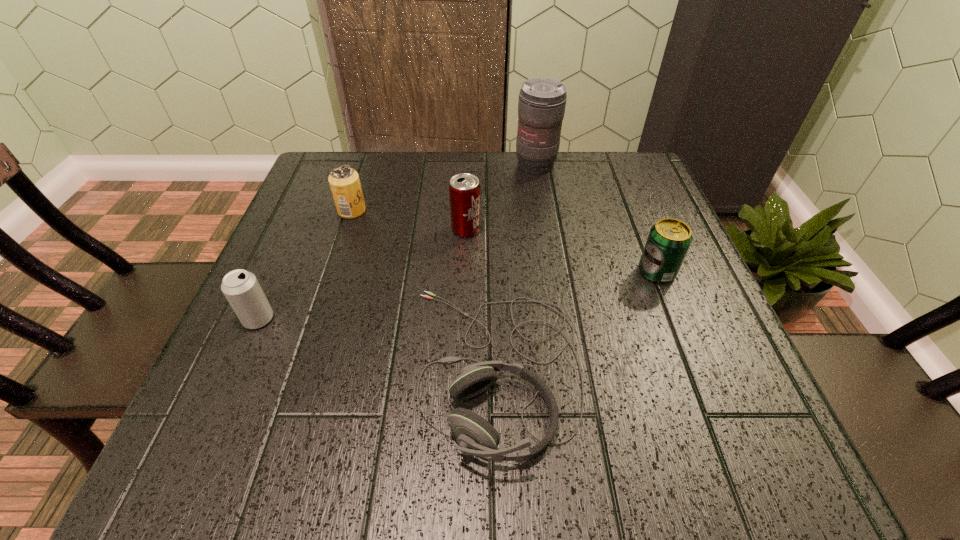
Where is `the farthest object`? the farthest object is located at coordinates (541, 107).

The height and width of the screenshot is (540, 960). In order to click on the tallest object in this screenshot , I will do [541, 107].

What are the coordinates of `the third farthest object` in the screenshot? It's located at (464, 189).

Where is `the second beer can from right to left`? the second beer can from right to left is located at coordinates (464, 189).

Find the location of `the third farthest beer can`. the third farthest beer can is located at coordinates (668, 242).

Locate an element on the screen. The width and height of the screenshot is (960, 540). the fourth farthest object is located at coordinates (668, 242).

Where is `the second object from left to right`? the second object from left to right is located at coordinates (344, 181).

What are the coordinates of `the farthest beer can` in the screenshot? It's located at (344, 181).

You are a GUI agent. You are given a task and a screenshot of the screen. Output one action in this format:
    pyautogui.click(x=<x>, y=<y>)
    Task: Click on the leftmost beer can
    This screenshot has width=960, height=540.
    Given the screenshot: What is the action you would take?
    pyautogui.click(x=241, y=288)

Locate an element on the screen. This screenshot has width=960, height=540. the nearest beer can is located at coordinates (241, 288).